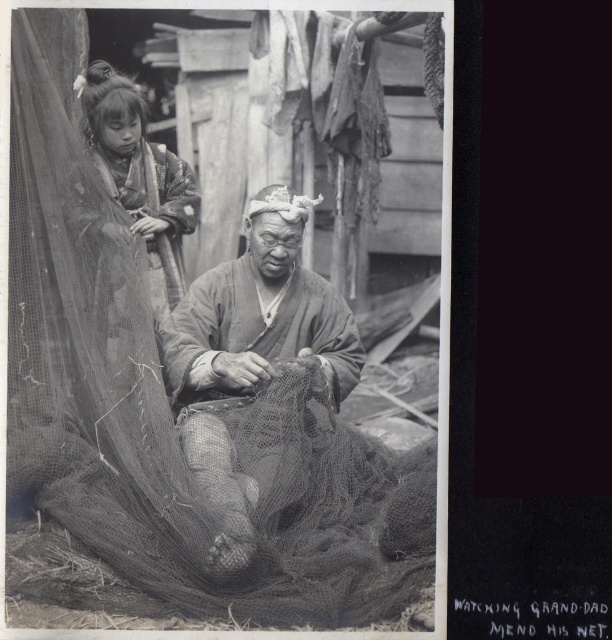
Question: Can you confirm if coarse mesh net at center is wider than matte fabric man at center?

Choices:
 (A) no
 (B) yes

Answer: (B)

Question: Which point appears closest to the camera in this image?

Choices:
 (A) coord(256,276)
 (B) coord(113,116)

Answer: (B)

Question: Can you confirm if coarse mesh net at center is wider than matte fabric man at center?

Choices:
 (A) yes
 (B) no

Answer: (A)

Question: Which object is the farthest from the matte fabric man at center?

Choices:
 (A) coarse mesh net at center
 (B) smooth fabric kimono at upper left

Answer: (B)

Question: Is matte fabric man at center smaller than smooth fabric kimono at upper left?

Choices:
 (A) yes
 (B) no

Answer: (B)

Question: Which of the following is the closest to the observer?

Choices:
 (A) coarse mesh net at center
 (B) smooth fabric kimono at upper left
 (C) matte fabric man at center

Answer: (C)